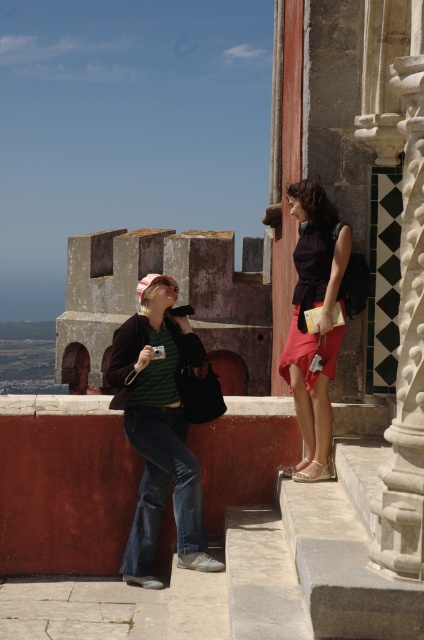
Question: Which point is farther from the camera taking this photo?

Choices:
 (A) pos(309,275)
 (B) pos(150,326)

Answer: (B)

Question: Does green striped shirt at center have a larger size compared to matte black top at center?

Choices:
 (A) yes
 (B) no

Answer: (A)

Question: Where is green striped shirt at center located in relation to matte black top at center in the image?

Choices:
 (A) right
 (B) left

Answer: (B)

Question: Among these points, which one is farthest from the camera?

Choices:
 (A) pyautogui.click(x=197, y=492)
 (B) pyautogui.click(x=326, y=326)

Answer: (B)

Question: Does green striped shirt at center appear over matte black top at center?

Choices:
 (A) yes
 (B) no

Answer: (B)